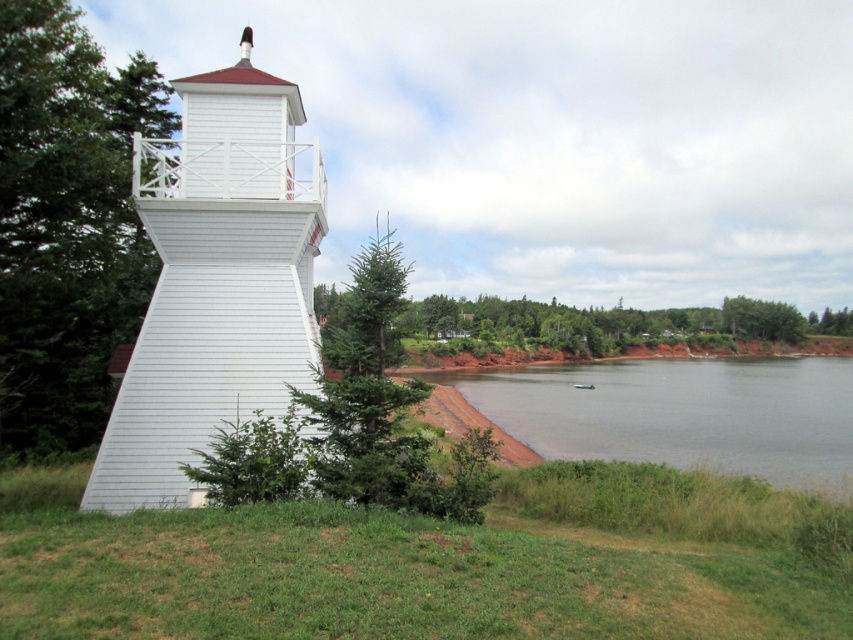
Question: From the image, what is the correct spatial relationship of green grassy at lower left in relation to white wooden tower at left?

Choices:
 (A) left
 (B) right

Answer: (B)

Question: Which point appears farthest from the camera in this image?

Choices:
 (A) (270, 410)
 (B) (509, 614)

Answer: (A)

Question: Can you confirm if green grassy at lower left is wider than white wooden tower at left?

Choices:
 (A) no
 (B) yes

Answer: (B)

Question: Among these objects, which one is farthest from the camera?

Choices:
 (A) green grassy at lower left
 (B) white wooden tower at left

Answer: (B)

Question: Is green grassy at lower left wider than white wooden tower at left?

Choices:
 (A) no
 (B) yes

Answer: (B)